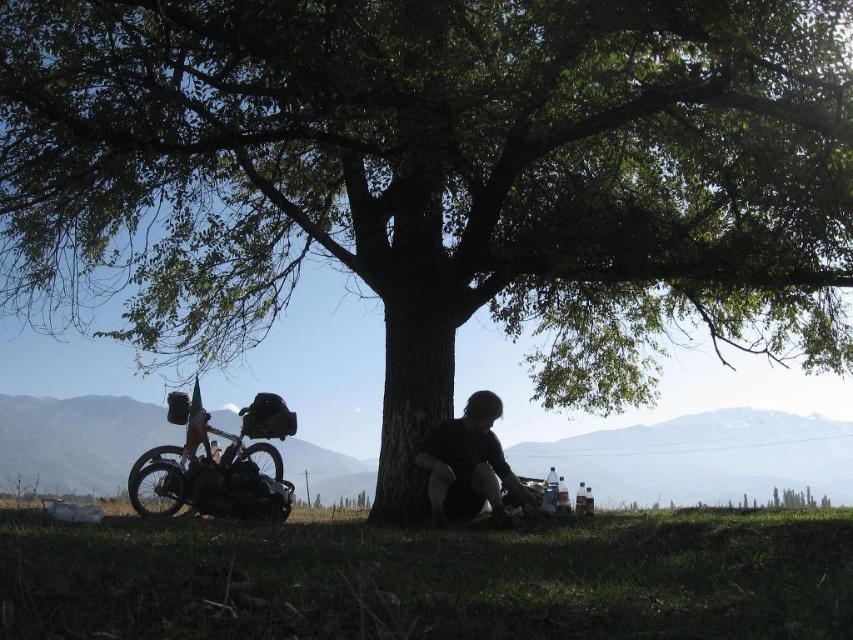
Question: In this image, where is silver metallic bicycle at left located relative to black matte shirt at lower center?

Choices:
 (A) above
 (B) below

Answer: (B)

Question: Can you confirm if green grass at lower center is thinner than black matte shirt at lower center?

Choices:
 (A) yes
 (B) no

Answer: (B)

Question: Which of the following is the closest to the observer?

Choices:
 (A) green grass at lower center
 (B) black matte shirt at lower center
 (C) silver metallic bicycle at left

Answer: (A)

Question: Does green grass at lower center appear on the left side of silver metallic bicycle at left?

Choices:
 (A) no
 (B) yes

Answer: (A)

Question: Which point appears farthest from the camera in this image?

Choices:
 (A) (848, 513)
 (B) (199, 417)

Answer: (B)

Question: Which is nearer to the silver metallic bicycle at left?

Choices:
 (A) green grass at lower center
 (B) black matte shirt at lower center

Answer: (B)